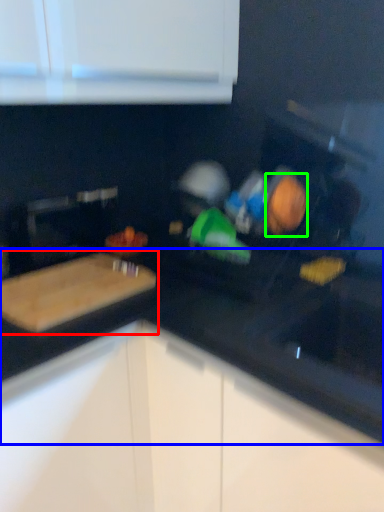
Question: Estimate the real-world distances between objects in this image. Which object is farther from cutting board (highlighted by a red box), countertop (highlighted by a blue box) or food (highlighted by a green box)?

Choices:
 (A) countertop
 (B) food

Answer: (B)